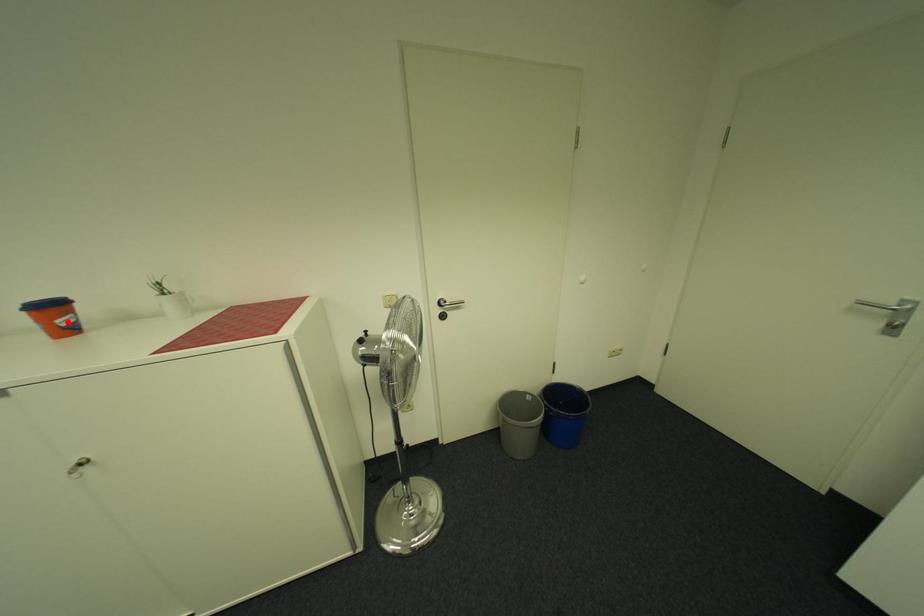
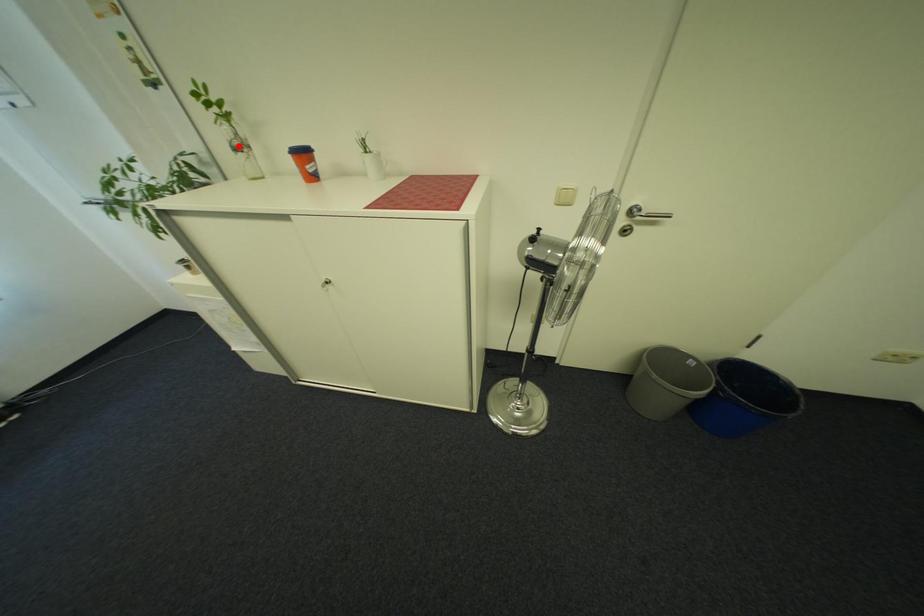
I am providing you with two images of the same scene from different viewpoints. A red point is marked on the first image and another point is marked on the second image. Is the red point in image1 aligned with the point shown in image2?

No